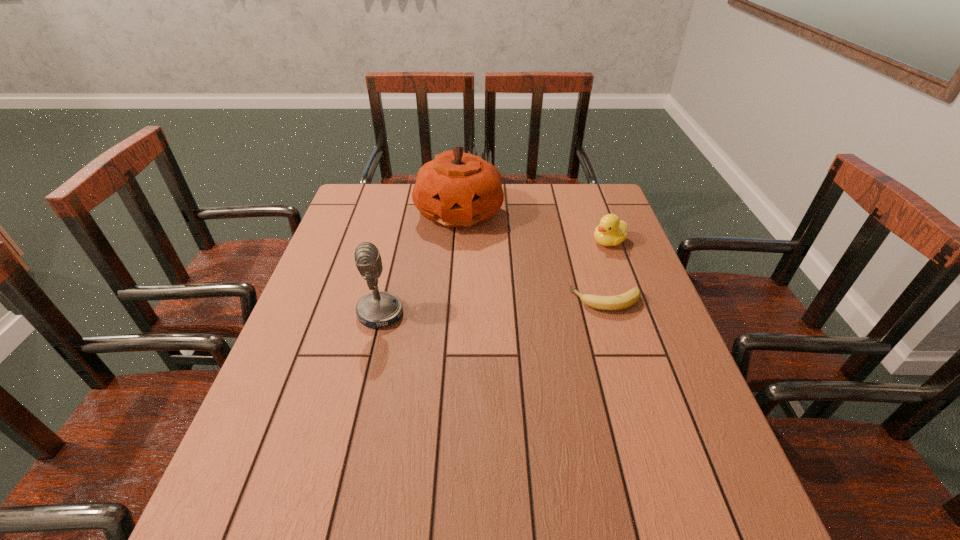
Find the location of a particular element. free region located 0.230m on the front-facing side of the pumpkin is located at coordinates point(496,284).

Locate an element on the screen. This screenshot has height=540, width=960. free space located 0.230m on the front-facing side of the pumpkin is located at coordinates (496, 284).

I want to click on vacant region located 0.330m on the beak of the duckling, so click(x=512, y=292).

Find the location of `vacant space located on the beak of the duckling`. vacant space located on the beak of the duckling is located at coordinates (542, 276).

The height and width of the screenshot is (540, 960). Identify the location of vacant space located 0.130m on the beak of the duckling. (565, 264).

Find the location of a particular element. Image resolution: width=960 pixels, height=540 pixels. object that is at the far edge is located at coordinates (456, 189).

Locate an element on the screen. This screenshot has width=960, height=540. object that is positioned at the left edge is located at coordinates (379, 308).

Find the location of `banana situated at the right edge`. banana situated at the right edge is located at coordinates (629, 298).

The image size is (960, 540). What are the coordinates of `duckling present at the right edge` in the screenshot? It's located at (611, 231).

In the image, there is a desktop. At what (x,y) coordinates should I click in order to perform the action: click on vacant space at the far edge. Please return your answer as a coordinate pair (x, y). The width and height of the screenshot is (960, 540). Looking at the image, I should click on (547, 220).